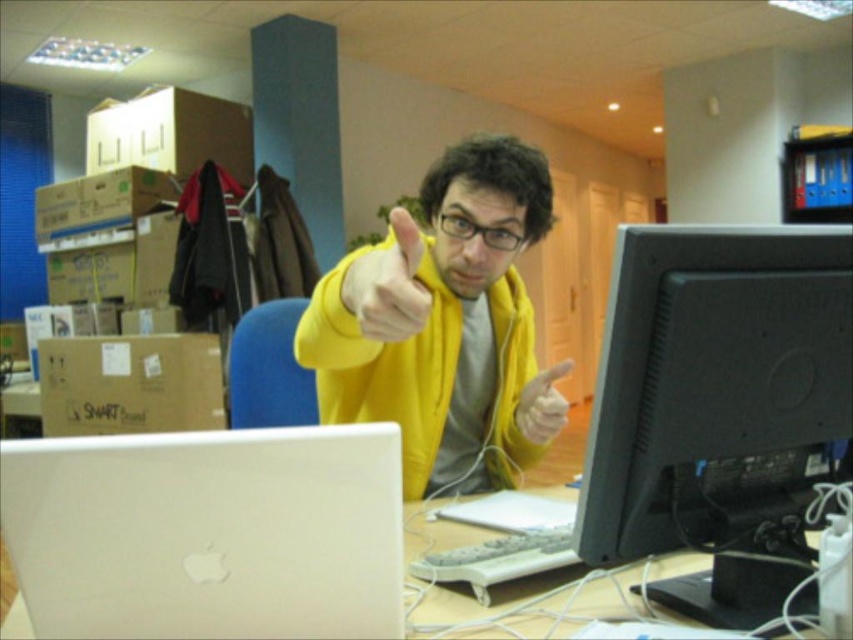
Question: Which object appears farthest from the camera in this image?

Choices:
 (A) white plastic table at center
 (B) satin white laptop at lower left
 (C) yellow fabric glove at center

Answer: (C)

Question: Can you confirm if yellow matte hand at center is positioned to the left of yellow fabric glove at center?

Choices:
 (A) no
 (B) yes

Answer: (B)

Question: Is white plastic table at center closer to camera compared to yellow fabric glove at center?

Choices:
 (A) yes
 (B) no

Answer: (A)

Question: Which object is farther from the camera taking this photo?

Choices:
 (A) yellow matte jacket at center
 (B) black matte monitor at right
 (C) yellow matte hand at center

Answer: (B)

Question: Based on their relative distances, which object is nearer to the yellow matte jacket at center?

Choices:
 (A) yellow fabric glove at center
 (B) satin white laptop at lower left
 (C) black matte monitor at right
 (D) yellow matte hand at center

Answer: (D)

Question: Can you confirm if satin white laptop at lower left is positioned to the left of yellow matte hand at center?

Choices:
 (A) no
 (B) yes

Answer: (B)